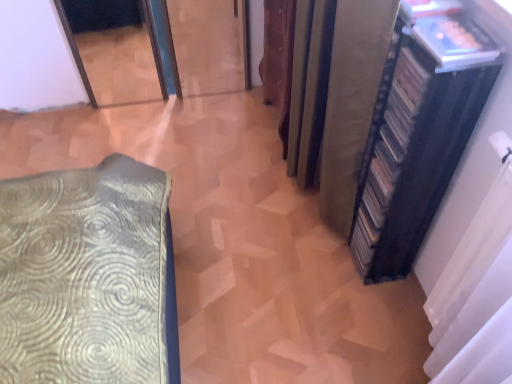
Find the location of a particular element. This screenshot has width=512, height=384. translucent plastic book at upper right is located at coordinates (455, 41).

In the scene shown: Measure the distance between point (443, 44) and camera.

A distance of 35.08 inches exists between point (443, 44) and camera.

Locate an element on the screen. The height and width of the screenshot is (384, 512). black matte bookshelf at right is located at coordinates (419, 131).

Identify the location of silky beige curtain at right, marked as the first curtain in a left-to-right arrangement. (352, 102).

Locate an element on the screen. This screenshot has height=384, width=512. translucent plastic book at upper right is located at coordinates (455, 41).

Considering the positions of objects silky beige curtain at right, placed as the 2th curtain when sorted from right to left, and black matte bookshelf at right in the image provided, who is more to the right, silky beige curtain at right, placed as the 2th curtain when sorted from right to left, or black matte bookshelf at right?

From the viewer's perspective, black matte bookshelf at right appears more on the right side.

Which is correct: silky beige curtain at right, marked as the first curtain in a left-to-right arrangement, is inside black matte bookshelf at right, or outside of it?

silky beige curtain at right, marked as the first curtain in a left-to-right arrangement, exists outside the volume of black matte bookshelf at right.

From the image's perspective, is silky beige curtain at right, placed as the 2th curtain when sorted from right to left, located above or below black matte bookshelf at right?

From the image's perspective, silky beige curtain at right, placed as the 2th curtain when sorted from right to left, appears above black matte bookshelf at right.

Is silky beige curtain at right, placed as the 2th curtain when sorted from right to left, shorter than black matte bookshelf at right?

No.

Is black matte curtain at right, which appears as the first curtain when viewed from the right, positioned with its back to silky beige curtain at right, marked as the first curtain in a left-to-right arrangement?

No, black matte curtain at right, which appears as the first curtain when viewed from the right,'s orientation is not away from silky beige curtain at right, marked as the first curtain in a left-to-right arrangement.

From a real-world perspective, is black matte curtain at right, which ranks as the second curtain in left-to-right order, positioned above or below silky beige curtain at right, marked as the first curtain in a left-to-right arrangement?

black matte curtain at right, which ranks as the second curtain in left-to-right order, is below silky beige curtain at right, marked as the first curtain in a left-to-right arrangement.

Is the position of black matte curtain at right, which appears as the first curtain when viewed from the right, more distant than that of silky beige curtain at right, placed as the 2th curtain when sorted from right to left?

No.

The image size is (512, 384). I want to click on curtain located behind the black matte curtain at right, which ranks as the second curtain in left-to-right order, so click(352, 102).

Based on the photo, which is further, (337, 182) or (499, 260)?

The point (337, 182) is behind.

Does silky beige curtain at right, placed as the 2th curtain when sorted from right to left, appear on the left side of black matte curtain at right, which appears as the first curtain when viewed from the right?

Yes.

Is silky beige curtain at right, marked as the first curtain in a left-to-right arrangement, turned away from black matte curtain at right, which appears as the first curtain when viewed from the right?

That's not correct — silky beige curtain at right, marked as the first curtain in a left-to-right arrangement, is not looking away from black matte curtain at right, which appears as the first curtain when viewed from the right.

Does translucent plastic book at upper right turn towards black matte curtain at right, which appears as the first curtain when viewed from the right?

No, translucent plastic book at upper right does not turn towards black matte curtain at right, which appears as the first curtain when viewed from the right.

Is there a large distance between translucent plastic book at upper right and black matte curtain at right, which ranks as the second curtain in left-to-right order?

No, there isn't a large distance between translucent plastic book at upper right and black matte curtain at right, which ranks as the second curtain in left-to-right order.

Which object is positioned more to the right, translucent plastic book at upper right or black matte curtain at right, which appears as the first curtain when viewed from the right?

black matte curtain at right, which appears as the first curtain when viewed from the right.

Is translucent plastic book at upper right positioned in front of black matte curtain at right, which appears as the first curtain when viewed from the right?

No.

From the image's perspective, starting from the translucent plastic book at upper right, which curtain is the 1st one below? Please provide its 2D coordinates.

[(352, 102)]

Is silky beige curtain at right, placed as the 2th curtain when sorted from right to left, beside translucent plastic book at upper right?

No, silky beige curtain at right, placed as the 2th curtain when sorted from right to left, is not next to translucent plastic book at upper right.

From a real-world perspective, which object rests below the other?

silky beige curtain at right, marked as the first curtain in a left-to-right arrangement, from a real-world perspective.

In the image, is translucent plastic book at upper right positioned in front of or behind silky beige curtain at right, marked as the first curtain in a left-to-right arrangement?

Visually, translucent plastic book at upper right is located in front of silky beige curtain at right, marked as the first curtain in a left-to-right arrangement.

Does translucent plastic book at upper right appear on the right side of silky beige curtain at right, placed as the 2th curtain when sorted from right to left?

Yes, translucent plastic book at upper right is to the right of silky beige curtain at right, placed as the 2th curtain when sorted from right to left.

Is translucent plastic book at upper right aimed at silky beige curtain at right, marked as the first curtain in a left-to-right arrangement?

No, translucent plastic book at upper right is not turned towards silky beige curtain at right, marked as the first curtain in a left-to-right arrangement.

Is translucent plastic book at upper right inside the boundaries of black matte bookshelf at right, or outside?

translucent plastic book at upper right is contained in black matte bookshelf at right.

Does translucent plastic book at upper right have a larger size compared to black matte bookshelf at right?

Incorrect, translucent plastic book at upper right is not larger than black matte bookshelf at right.

Based on the photo, between translucent plastic book at upper right and black matte bookshelf at right, which one is positioned behind?

translucent plastic book at upper right.

You are a GUI agent. You are given a task and a screenshot of the screen. Output one action in this format:
    pyautogui.click(x=<x>, y=<y>)
    Task: Click on the bookshelf below the silky beige curtain at right, marked as the first curtain in a left-to-right arrangement (from the image's perspective)
    The width and height of the screenshot is (512, 384).
    Given the screenshot: What is the action you would take?
    pyautogui.click(x=419, y=131)

What are the coordinates of `curtain above the black matte curtain at right, which ranks as the second curtain in left-to-right order (from a real-world perspective)` in the screenshot? It's located at (352, 102).

Based on their spatial positions, is black matte bookshelf at right or black matte curtain at right, which ranks as the second curtain in left-to-right order, further from translucent plastic book at upper right?

black matte curtain at right, which ranks as the second curtain in left-to-right order.

From the image, which object appears to be farther from silky beige curtain at right, placed as the 2th curtain when sorted from right to left, translucent plastic book at upper right or black matte curtain at right, which ranks as the second curtain in left-to-right order?

black matte curtain at right, which ranks as the second curtain in left-to-right order, is positioned further to the anchor silky beige curtain at right, placed as the 2th curtain when sorted from right to left.

Estimate the real-world distances between objects in this image. Which object is further from black matte curtain at right, which appears as the first curtain when viewed from the right, black matte bookshelf at right or translucent plastic book at upper right?

Among the two, translucent plastic book at upper right is located further to black matte curtain at right, which appears as the first curtain when viewed from the right.

Looking at the image, which one is located further to translucent plastic book at upper right, black matte bookshelf at right or silky beige curtain at right, placed as the 2th curtain when sorted from right to left?

silky beige curtain at right, placed as the 2th curtain when sorted from right to left.

Based on their spatial positions, is silky beige curtain at right, placed as the 2th curtain when sorted from right to left, or black matte bookshelf at right closer to black matte curtain at right, which appears as the first curtain when viewed from the right?

Among the two, black matte bookshelf at right is located nearer to black matte curtain at right, which appears as the first curtain when viewed from the right.

Which object lies nearer to the anchor point black matte bookshelf at right, translucent plastic book at upper right or black matte curtain at right, which appears as the first curtain when viewed from the right?

Based on the image, translucent plastic book at upper right appears to be nearer to black matte bookshelf at right.

When comparing their distances from translucent plastic book at upper right, does silky beige curtain at right, marked as the first curtain in a left-to-right arrangement, or black matte bookshelf at right seem closer?

black matte bookshelf at right is closer to translucent plastic book at upper right.

Looking at the image, which one is located further to black matte curtain at right, which ranks as the second curtain in left-to-right order, translucent plastic book at upper right or silky beige curtain at right, marked as the first curtain in a left-to-right arrangement?

silky beige curtain at right, marked as the first curtain in a left-to-right arrangement, lies further to black matte curtain at right, which ranks as the second curtain in left-to-right order, than the other object.

Where is `curtain that lies between translucent plastic book at upper right and black matte curtain at right, which appears as the first curtain when viewed from the right, from top to bottom`? The width and height of the screenshot is (512, 384). curtain that lies between translucent plastic book at upper right and black matte curtain at right, which appears as the first curtain when viewed from the right, from top to bottom is located at coordinates (352, 102).

The height and width of the screenshot is (384, 512). Find the location of `bookshelf between translucent plastic book at upper right and black matte curtain at right, which appears as the first curtain when viewed from the right, in the vertical direction`. bookshelf between translucent plastic book at upper right and black matte curtain at right, which appears as the first curtain when viewed from the right, in the vertical direction is located at coordinates (419, 131).

Image resolution: width=512 pixels, height=384 pixels. I want to click on curtain between translucent plastic book at upper right and black matte bookshelf at right in the vertical direction, so click(x=352, y=102).

The height and width of the screenshot is (384, 512). What are the coordinates of `bookshelf between silky beige curtain at right, placed as the 2th curtain when sorted from right to left, and black matte curtain at right, which appears as the first curtain when viewed from the right, from top to bottom` in the screenshot? It's located at (419, 131).